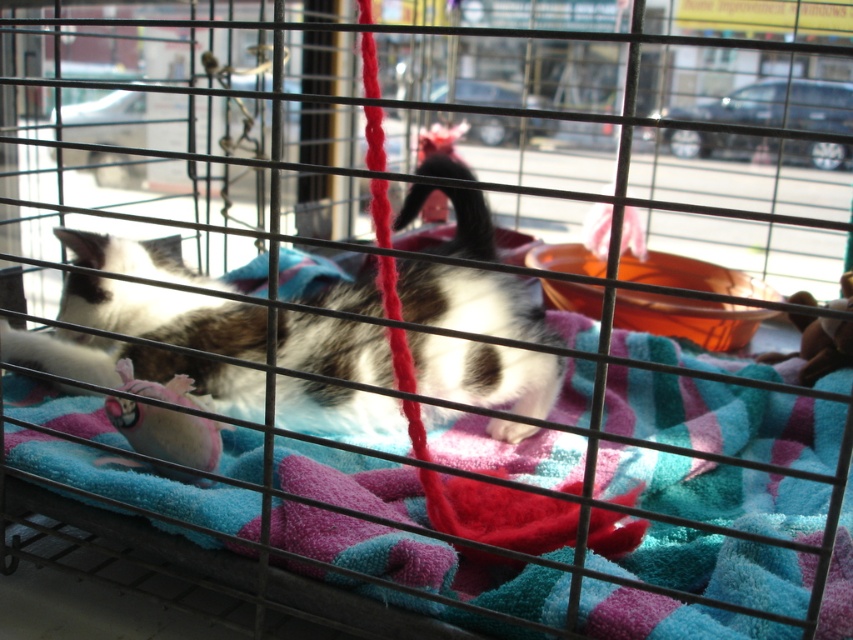
The width and height of the screenshot is (853, 640). Identify the location of fluffy white cat at center. (166, 316).

Can you confirm if fluffy white cat at center is positioned to the right of pink fabric toy at lower left?

Correct, you'll find fluffy white cat at center to the right of pink fabric toy at lower left.

The height and width of the screenshot is (640, 853). Find the location of `fluffy white cat at center`. fluffy white cat at center is located at coordinates (166, 316).

Can you confirm if fluffy white cat at center is positioned below rubber duck at center?

No, fluffy white cat at center is not below rubber duck at center.

Between fluffy white cat at center and rubber duck at center, which one has more height?

fluffy white cat at center

Who is more distant from viewer, (456, 269) or (845, 301)?

The point (845, 301) is more distant.

Locate an element on the screen. The width and height of the screenshot is (853, 640). fluffy white cat at center is located at coordinates (166, 316).

Is pink fabric toy at lower left closer to the viewer compared to rubber duck at center?

Yes.

Between point (109, 460) and point (844, 298), which one is positioned in front?

Positioned in front is point (109, 460).

At what (x,y) coordinates should I click in order to perform the action: click on pink fabric toy at lower left. Please return your answer as a coordinate pair (x, y). Looking at the image, I should click on (166, 433).